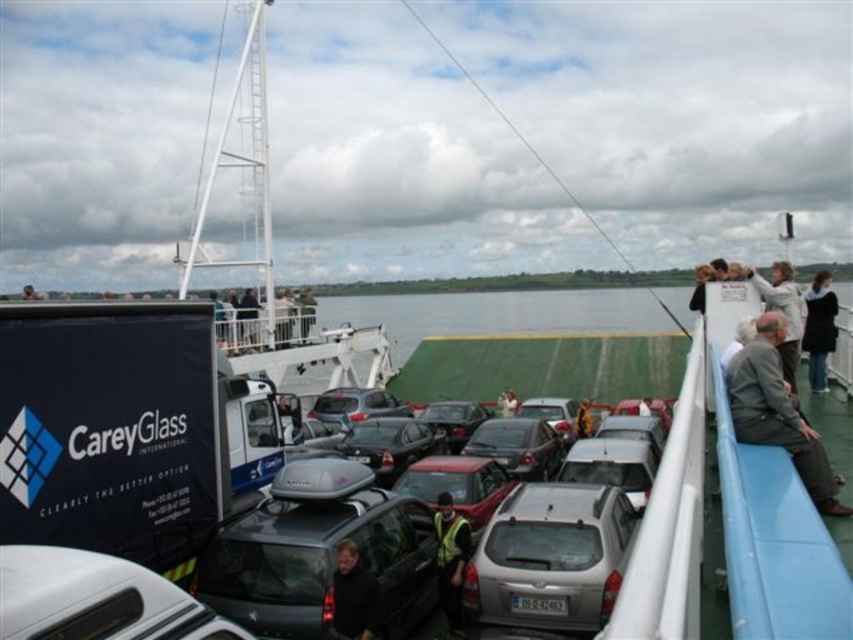
You are a passenger on the ferry and want to take a photo of the matte gray car at center without the white fabric jacket at upper right blocking your view. Is this possible?

The matte gray car at center is further to the viewer than the white fabric jacket at upper right, so the jacket is closer to you. You might need to move closer to the car or adjust your position to avoid the jacket blocking the view.